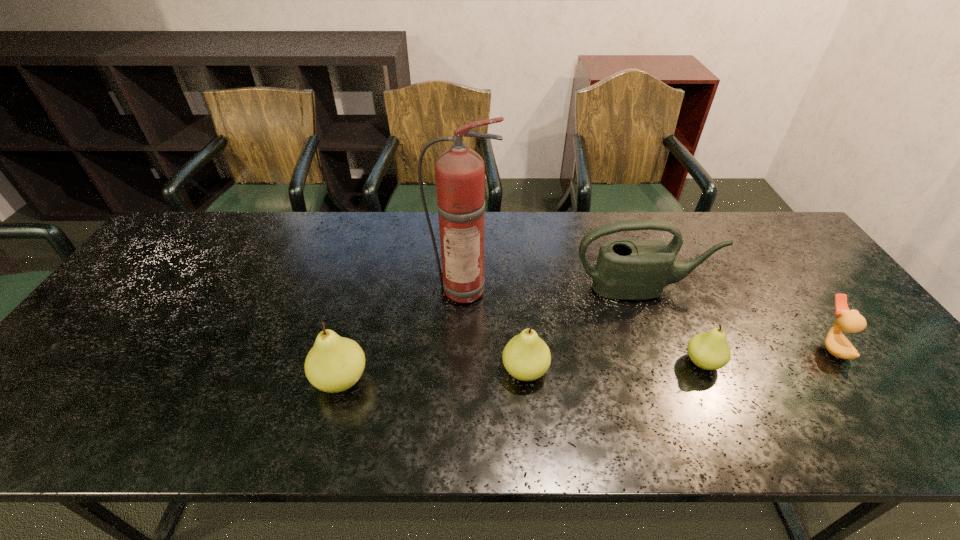
Please point a spot on the right to add another pear. Please provide its 2D coordinates. Your answer should be formatted as a tuple, i.e. [(x, y)], where the tuple contains the x and y coordinates of a point satisfying the conditions above.

[(874, 354)]